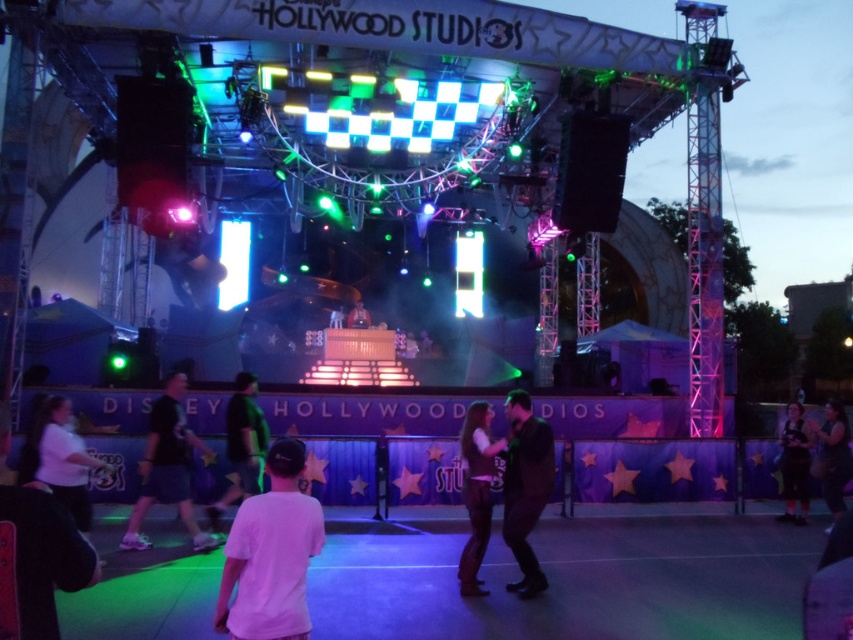
Question: Can you confirm if dark brown leather jacket at center is thinner than matte black jacket at center?

Choices:
 (A) no
 (B) yes

Answer: (B)

Question: Based on their relative distances, which object is farther from the dark brown suit at center?

Choices:
 (A) matte black jacket at center
 (B) white matte t-shirt at lower left

Answer: (A)

Question: Is dark brown suit at center to the right of dark gray fabric dress at lower right from the viewer's perspective?

Choices:
 (A) yes
 (B) no

Answer: (B)

Question: Which point is farther to the camera?

Choices:
 (A) white matte shirt at lower left
 (B) dark gray fabric pants at lower left
 (C) dark brown leather jacket at lower right

Answer: (C)

Question: Is dark gray fabric pants at lower left behind matte black jacket at center?

Choices:
 (A) no
 (B) yes

Answer: (A)

Question: Which point is closer to the camera?

Choices:
 (A) dark brown leather jacket at lower right
 (B) white matte t-shirt at lower left
 (C) dark gray fabric dress at lower right

Answer: (B)